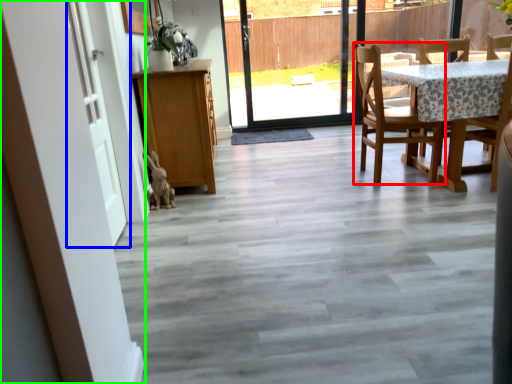
Question: Estimate the real-world distances between objects in this image. Which object is farther from chair (highlighted by a red box), door (highlighted by a blue box) or barn door (highlighted by a green box)?

Choices:
 (A) door
 (B) barn door

Answer: (B)